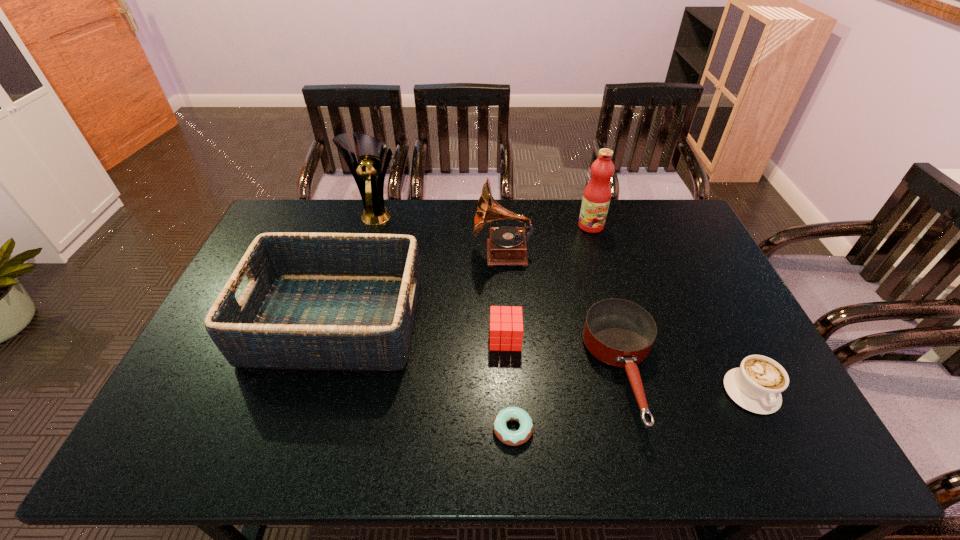
Locate an element on the screen. This screenshot has height=540, width=960. blank space that satisfies the following two spatial constraints: 1. on the front side of the shortest object; 2. on the right side of the fourth tallest object is located at coordinates (301, 429).

Identify the location of vacant space that satisfies the following two spatial constraints: 1. on the horn of the phonograph_record; 2. on the back side of the doughnut. The height and width of the screenshot is (540, 960). (512, 429).

The width and height of the screenshot is (960, 540). I want to click on free point that satisfies the following two spatial constraints: 1. on the horn of the shortest object; 2. on the right side of the third farthest object, so click(512, 429).

I want to click on free space in the image that satisfies the following two spatial constraints: 1. at the front of the award, where the globe is visible; 2. on the left side of the shortest object, so click(x=315, y=429).